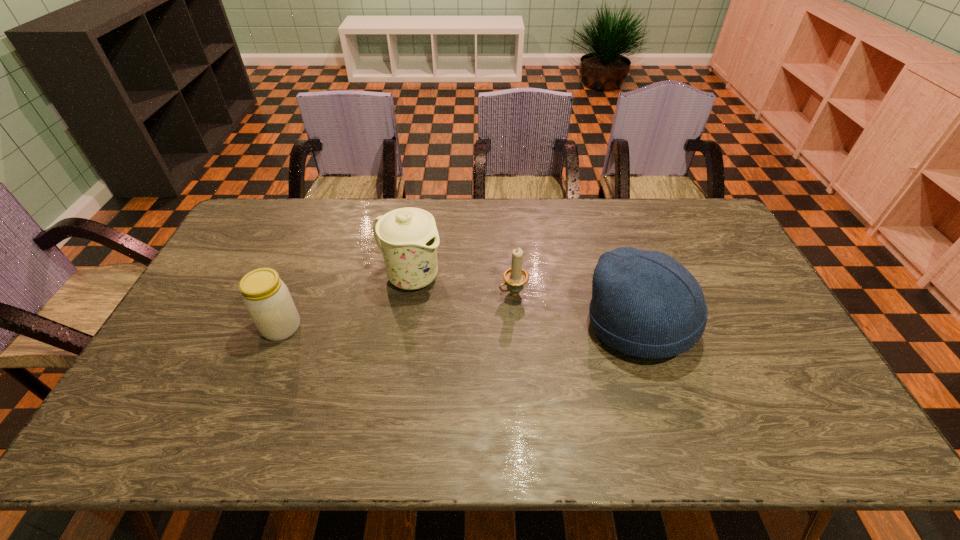
You are a GUI agent. You are given a task and a screenshot of the screen. Output one action in this format:
    pyautogui.click(x=<x>, y=<y>)
    Task: Click on the leftmost object
    This screenshot has width=960, height=540.
    Given the screenshot: What is the action you would take?
    pyautogui.click(x=267, y=299)

This screenshot has width=960, height=540. I want to click on the rightmost object, so click(x=646, y=304).

Find the location of a particular element. chinaware is located at coordinates (408, 237).

I want to click on candle_holder, so click(515, 277).

Find the location of `free location located 0.370m on the right of the leftmost object`. free location located 0.370m on the right of the leftmost object is located at coordinates (432, 327).

Find the location of a particular element. This screenshot has height=540, width=960. vacant area situated 0.230m on the left of the rightmost object is located at coordinates (505, 326).

The height and width of the screenshot is (540, 960). In order to click on vacant space located on the spout of the chinaware in this screenshot , I will do `click(482, 313)`.

Image resolution: width=960 pixels, height=540 pixels. What are the coordinates of `free space located on the spout of the chinaware` in the screenshot? It's located at (505, 325).

This screenshot has height=540, width=960. In order to click on free space located 0.390m on the spout of the chinaware in this screenshot , I will do [x=548, y=349].

At what (x,y) coordinates should I click in order to perform the action: click on vacant space situated on the handle side of the candle_holder. Please return your answer as a coordinate pair (x, y). Image resolution: width=960 pixels, height=540 pixels. Looking at the image, I should click on (468, 312).